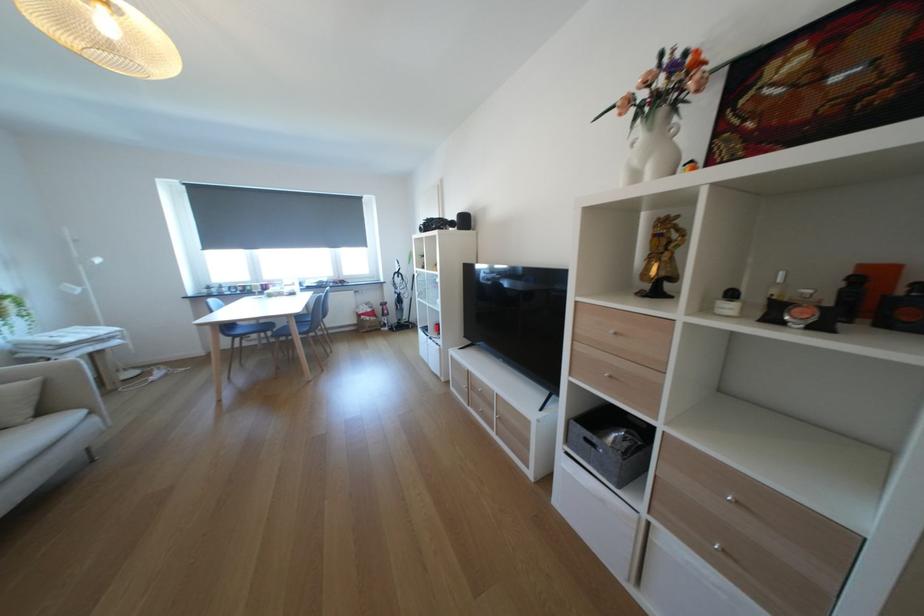
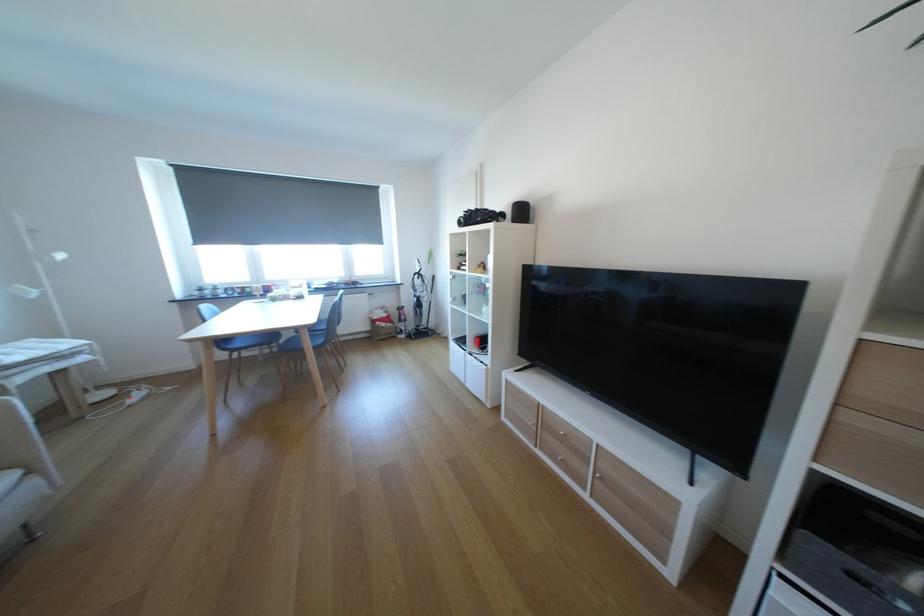
The point at (x=482, y=391) is marked in the first image. Where is the corresponding point in the second image?

(553, 429)